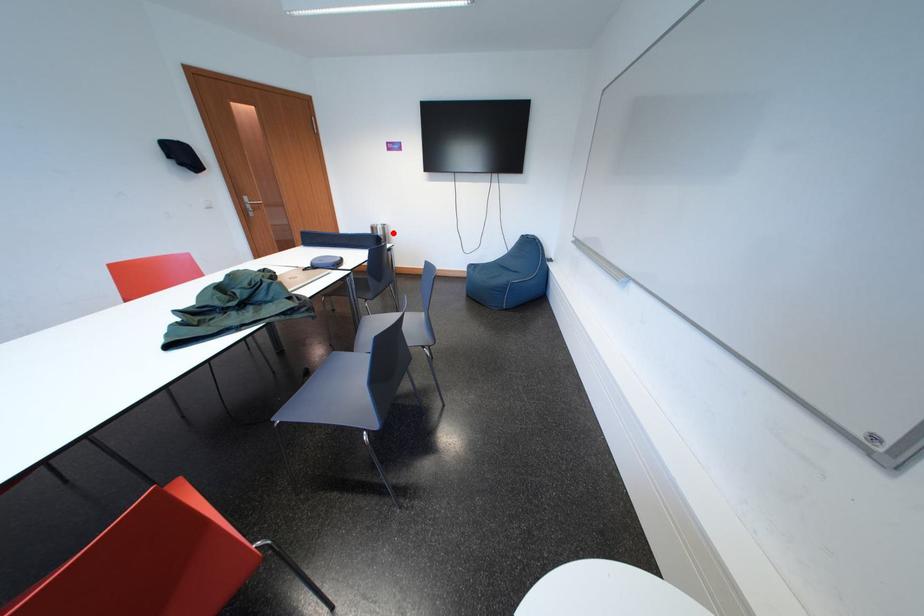
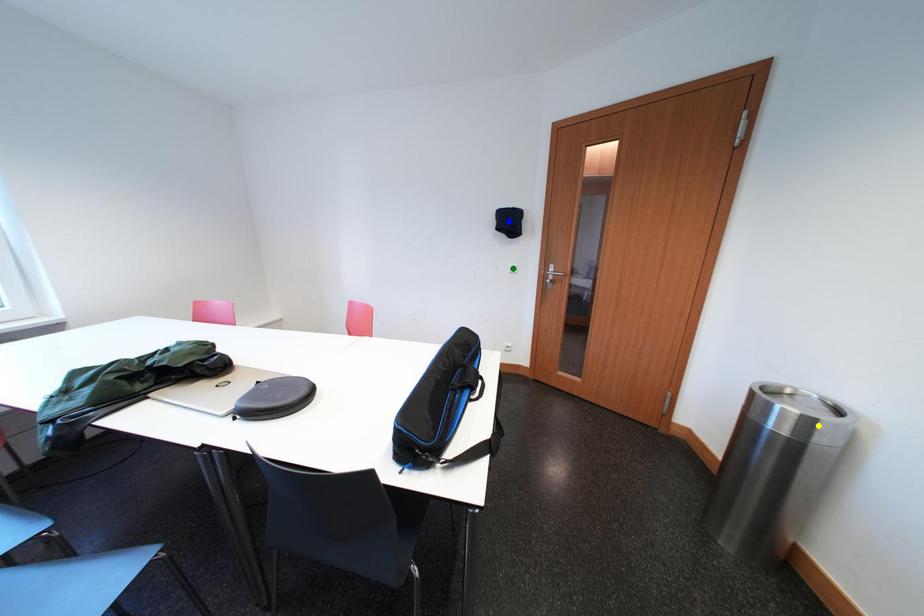
Question: I am providing you with two images of the same scene from different viewpoints. A red point is marked on the first image. You are given multiple points on the second image. Can you choose the point in image 2 that corresponds to the point in image 1?

Choices:
 (A) green point
 (B) blue point
 (C) yellow point

Answer: (C)